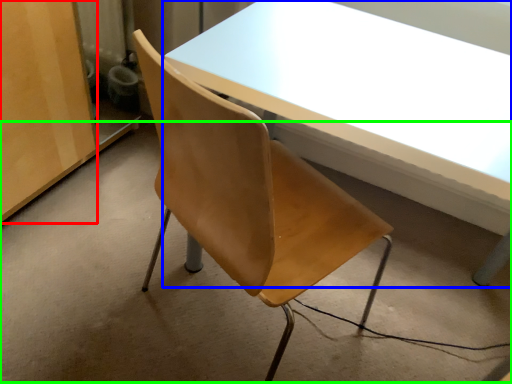
Question: Which object is the farthest from plywood (highlighted by a red box)? Choose among these: table (highlighted by a blue box) or concrete (highlighted by a green box).

Choices:
 (A) table
 (B) concrete

Answer: (A)